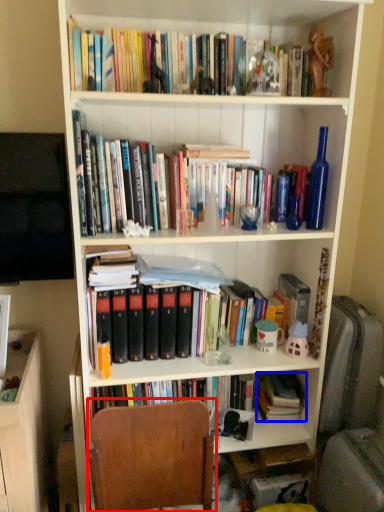
Question: Which object is closer to the camera taking this photo, chair (highlighted by a red box) or book (highlighted by a blue box)?

Choices:
 (A) chair
 (B) book

Answer: (A)